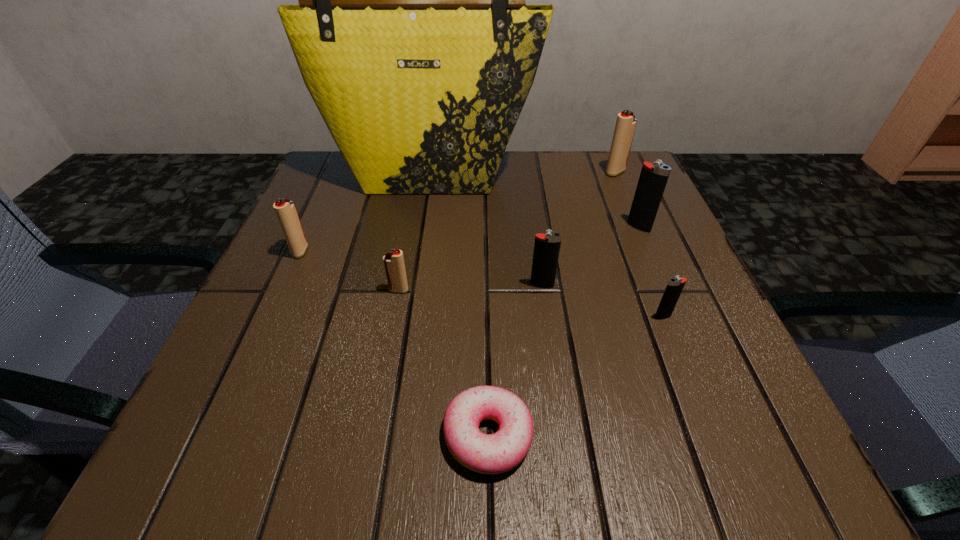
At what (x,y) coordinates should I click in order to perform the action: click on the fifth igniter from right to left. Please return your answer as a coordinate pair (x, y). Looking at the image, I should click on (394, 265).

In order to click on the smallest red igniter in this screenshot , I will do `click(394, 265)`.

The image size is (960, 540). Identify the location of the smallest black igniter. [x=675, y=285].

Identify the location of the nearest black igniter. The width and height of the screenshot is (960, 540). (675, 285).

The height and width of the screenshot is (540, 960). Find the location of `the shortest object`. the shortest object is located at coordinates (497, 453).

The image size is (960, 540). In order to click on doughnut in this screenshot , I will do `click(497, 453)`.

Where is `vacant space situated on the front-facing side of the yellow tote bag`? Image resolution: width=960 pixels, height=540 pixels. vacant space situated on the front-facing side of the yellow tote bag is located at coordinates (408, 319).

You are a GUI agent. You are given a task and a screenshot of the screen. Output one action in this format:
    pyautogui.click(x=<x>, y=<y>)
    Task: Click on the vacant space situated 0.380m on the front of the rightmost red igniter
    This screenshot has width=960, height=540.
    Given the screenshot: What is the action you would take?
    pyautogui.click(x=667, y=295)

The height and width of the screenshot is (540, 960). I want to click on vacant space located 0.070m on the front of the biggest black igniter, so click(651, 257).

Where is `vacant region located 0.300m on the back of the second smallest black igniter`? vacant region located 0.300m on the back of the second smallest black igniter is located at coordinates (528, 188).